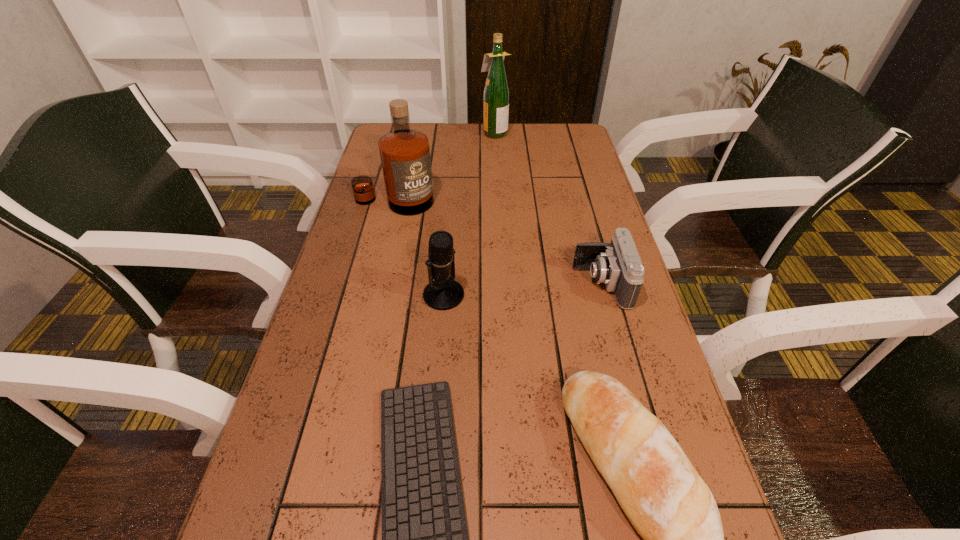
This screenshot has width=960, height=540. I want to click on unoccupied position between the camera and the third object from right to left, so click(x=548, y=208).

Choose which object is the third nearest neighbor to the fifth nearest object. Please provide its 2D coordinates. Your answer should be formatted as a tuple, i.e. [(x, y)], where the tuple contains the x and y coordinates of a point satisfying the conditions above.

[(617, 264)]

Identify which object is located as the second nearest to the microphone. Please provide its 2D coordinates. Your answer should be formatted as a tuple, i.e. [(x, y)], where the tuple contains the x and y coordinates of a point satisfying the conditions above.

[(404, 153)]

I want to click on free space in the image that satisfies the following two spatial constraints: 1. on the front label of the microphone; 2. on the left side of the second farthest object, so click(372, 295).

Where is `blank space that satisfies the following two spatial constraints: 1. on the front-facing side of the farthest object; 2. on the front label of the fifth nearest object`? blank space that satisfies the following two spatial constraints: 1. on the front-facing side of the farthest object; 2. on the front label of the fifth nearest object is located at coordinates (497, 202).